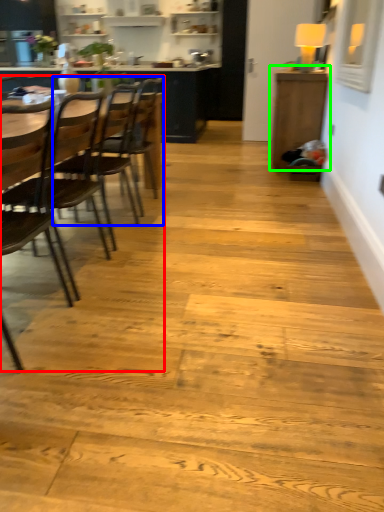
Question: Which object is positioned closest to armchair (highlighted by a red box)? Select from chair (highlighted by a blue box) and table (highlighted by a green box).

Choices:
 (A) chair
 (B) table

Answer: (A)